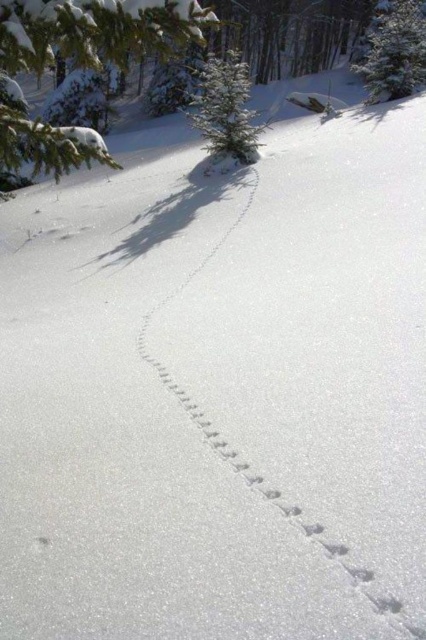
Is green textured pine branch at upper left above green textured evergreen tree at center?

Actually, green textured pine branch at upper left is below green textured evergreen tree at center.

Describe the element at coordinates (92, 29) in the screenshot. The image size is (426, 640). I see `green textured pine branch at upper left` at that location.

Where is `green textured pine branch at upper left`? green textured pine branch at upper left is located at coordinates (92, 29).

At what (x,y) coordinates should I click in order to perform the action: click on green textured pine branch at upper left. Please return your answer as a coordinate pair (x, y). Looking at the image, I should click on (92, 29).

Can you confirm if green textured pine tree at upper right is shorter than green textured evergreen tree at center?

Yes, green textured pine tree at upper right is shorter than green textured evergreen tree at center.

Can you confirm if green textured pine tree at upper right is taller than green textured evergreen tree at center?

No.

You are a GUI agent. You are given a task and a screenshot of the screen. Output one action in this format:
    pyautogui.click(x=<x>, y=<y>)
    Task: Click on the green textured pine tree at upper right
    
    Given the screenshot: What is the action you would take?
    pyautogui.click(x=394, y=51)

Based on the photo, between green textured pine branch at upper left and green textured pine tree at upper right, which one is positioned higher?

green textured pine tree at upper right is above.

Describe the element at coordinates (92, 29) in the screenshot. The image size is (426, 640). I see `green textured pine branch at upper left` at that location.

Identify the location of green textured pine branch at upper left. (92, 29).